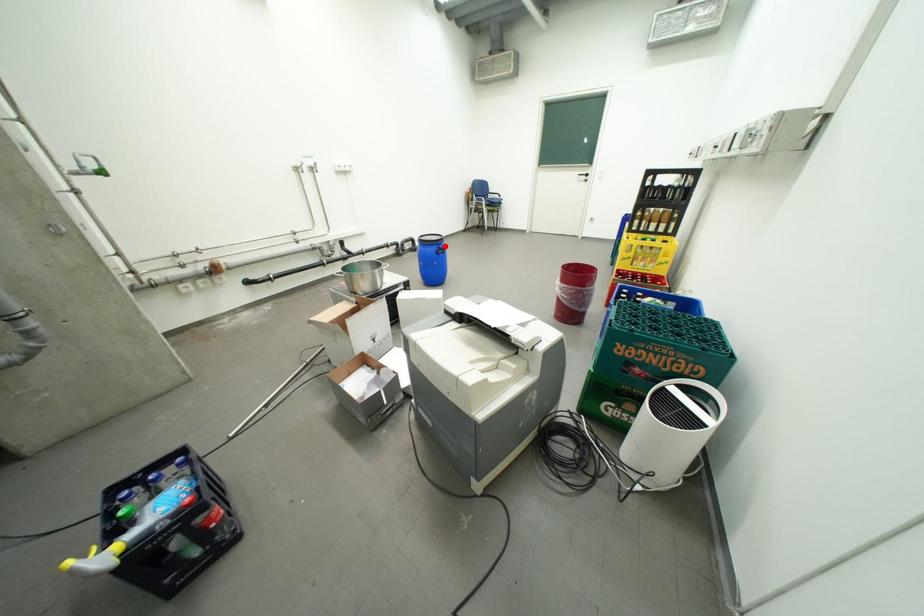
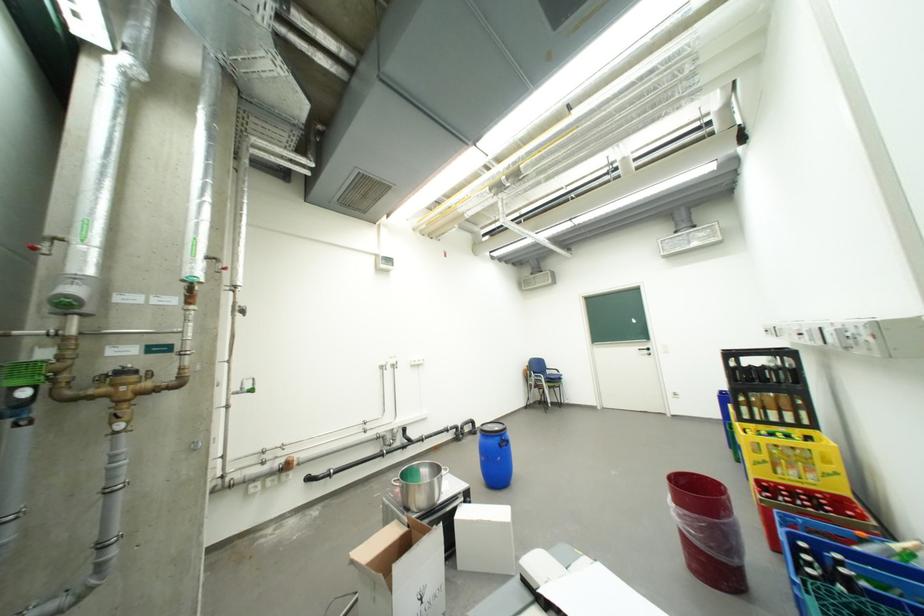
Question: I am providing you with two images of the same scene from different viewpoints. A red point is shown in image1. For the corresponding object point in image2, is it positioned nearer or farther from the camera?

Choices:
 (A) Nearer
 (B) Farther

Answer: (B)